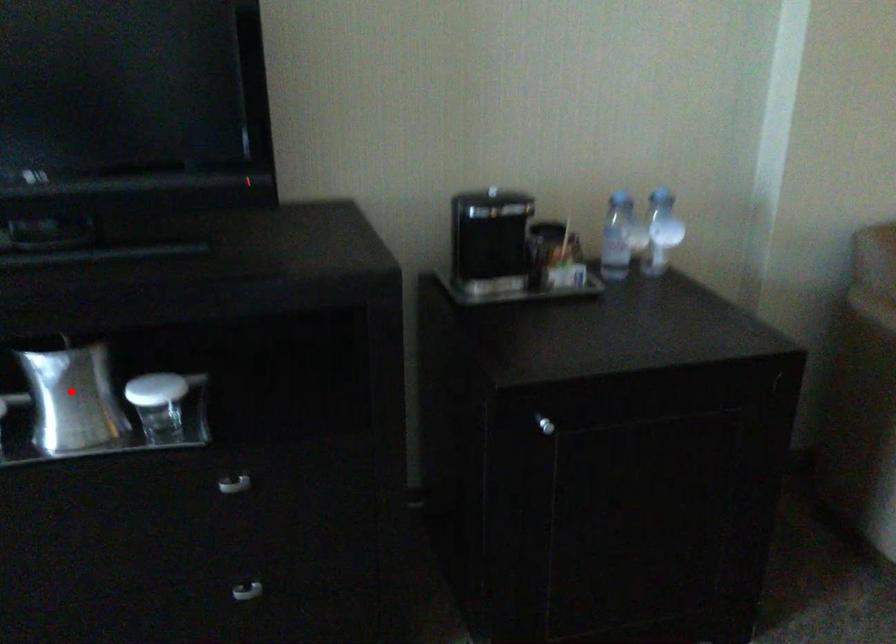
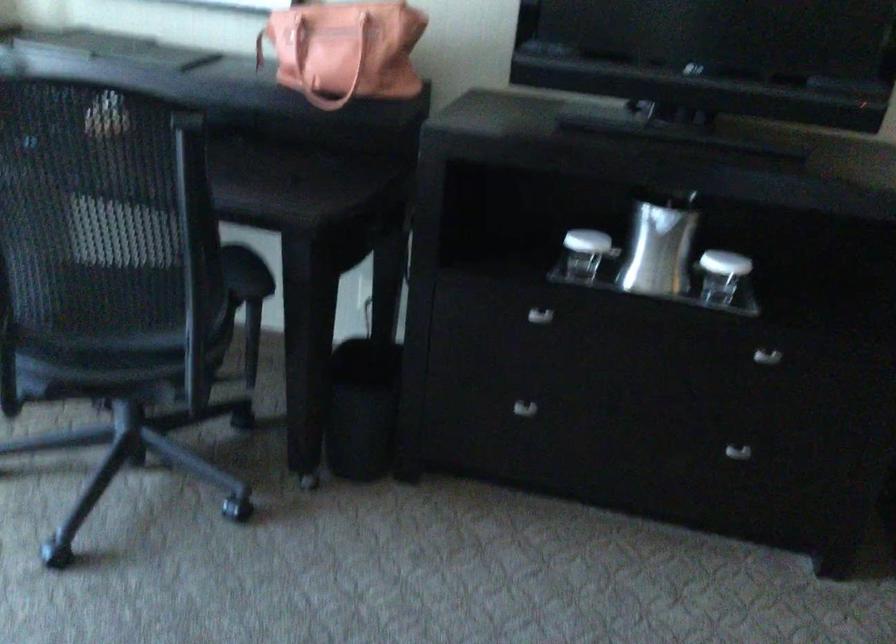
Find the pixel in the second image that matches the highlighted location in the first image.

(659, 245)